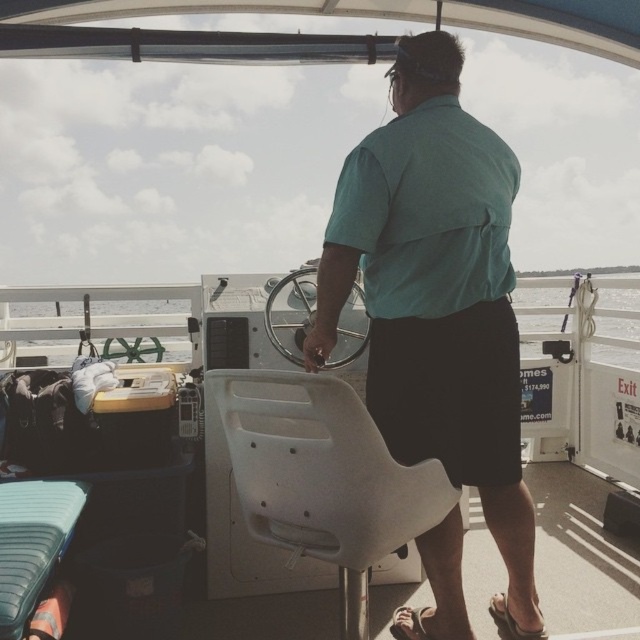
Question: Based on their relative distances, which object is nearer to the brown leather sandal at lower right?

Choices:
 (A) teal shirt at center
 (B) clear water at center

Answer: (A)

Question: Which point is farther to the camera?

Choices:
 (A) (403, 614)
 (B) (397, 64)
 (C) (548, 324)
 (D) (513, 625)

Answer: (C)

Question: Is clear water at center above brown leather sandal at lower right?

Choices:
 (A) no
 (B) yes

Answer: (B)

Question: From the image, what is the correct spatial relationship of brown leather sandal at lower right in relation to brown suede sandal at lower right?

Choices:
 (A) below
 (B) above

Answer: (A)

Question: Which is nearer to the brown leather sandal at lower right?

Choices:
 (A) clear water at center
 (B) brown suede sandal at lower right
 (C) teal shirt at center

Answer: (B)

Question: Can you confirm if clear water at center is wider than brown leather sandal at lower right?

Choices:
 (A) no
 (B) yes

Answer: (B)